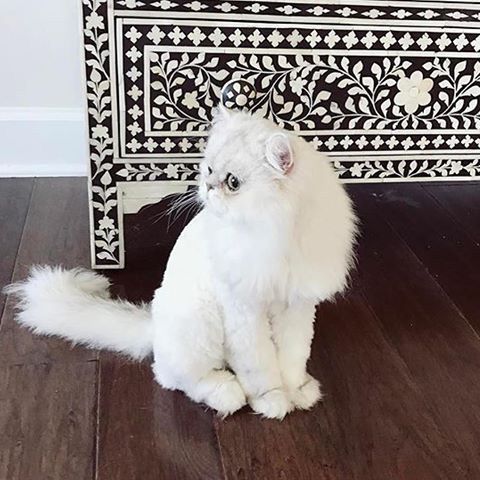
Identify the location of furniture. click(392, 140).